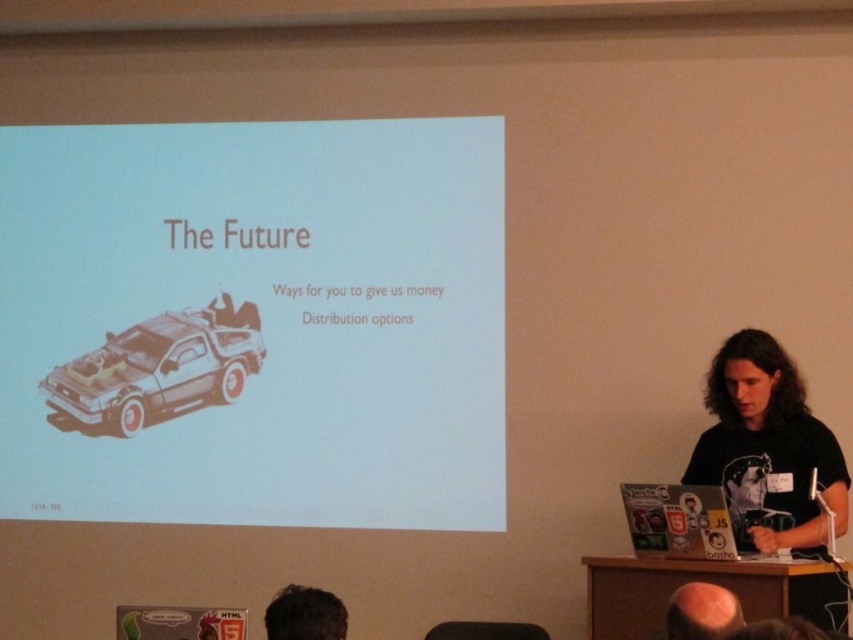
Does point (94, 458) come closer to viewer compared to point (697, 593)?

No, it is behind (697, 593).

Between point (445, 353) and point (718, 634), which one is positioned behind?

The point (445, 353) is behind.

Describe the element at coordinates (254, 323) in the screenshot. I see `white paper at center` at that location.

Where is `white paper at center`? Image resolution: width=853 pixels, height=640 pixels. white paper at center is located at coordinates (254, 323).

Is white paper at center closer to camera compared to metallic silver car at center?

Yes.

Between point (142, 385) and point (180, 358), which one is positioned in front?

Point (180, 358)

What do you see at coordinates (254, 323) in the screenshot?
I see `white paper at center` at bounding box center [254, 323].

Find the location of a particular element. This screenshot has width=853, height=640. white paper at center is located at coordinates (254, 323).

This screenshot has height=640, width=853. What do you see at coordinates (158, 369) in the screenshot?
I see `metallic silver car at center` at bounding box center [158, 369].

Describe the element at coordinates (158, 369) in the screenshot. I see `metallic silver car at center` at that location.

At what (x,y) coordinates should I click in order to perform the action: click on metallic silver car at center. Please return your answer as a coordinate pair (x, y). Looking at the image, I should click on (158, 369).